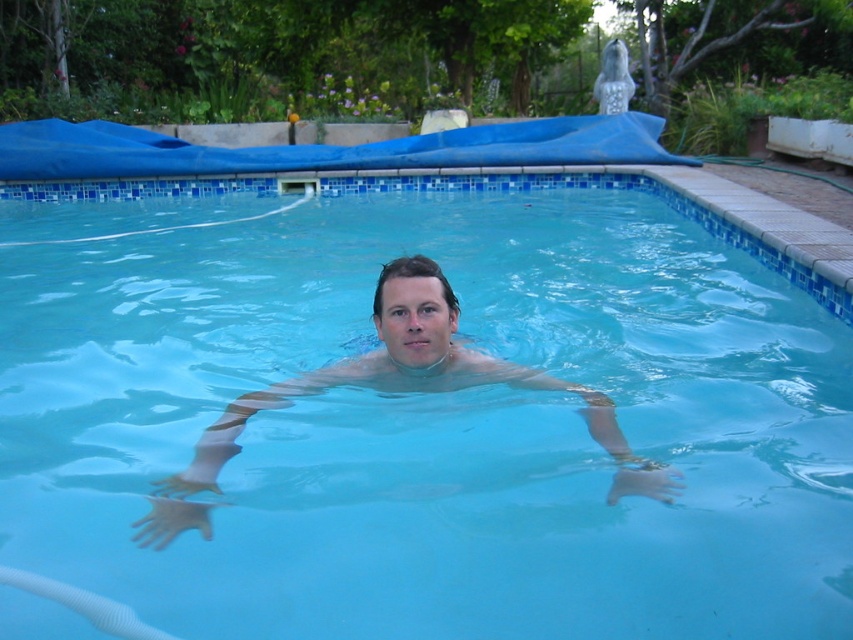
You are standing at the poolside and see two points marked in the water. The first point is at coordinates point (x=189, y=196) and the second is at point (x=392, y=371). If you want to swim towards the point that is further away from you, which coordinate should you head towards?

You should head towards point (x=189, y=196) because it is behind point (x=392, y=371), meaning it is farther away from your current position at the poolside.

You are a lifeguard observing the pool area. You notice a swimmer at the center of the pool. Based on the scene, can you determine if the transparent blue water at center is above or below the clear skin at center?

The transparent blue water at center is above the clear skin at center.